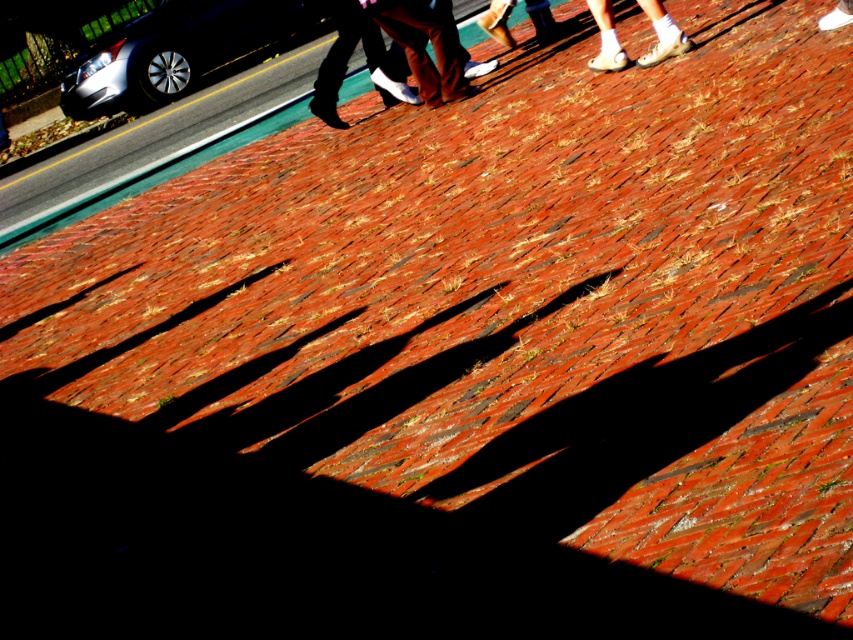
Question: Is brown leather shoes at upper center closer to the viewer compared to matte brown pants at upper center?

Choices:
 (A) yes
 (B) no

Answer: (A)

Question: Does satin silver car at upper left appear on the left side of brown leather shoes at upper center?

Choices:
 (A) yes
 (B) no

Answer: (A)

Question: Which point is closer to the camera taking this photo?

Choices:
 (A) (654, 51)
 (B) (498, 26)
 (C) (270, 28)
 (D) (427, 52)

Answer: (A)

Question: Does brown leather shoes at upper center have a smaller size compared to white socks at upper center?

Choices:
 (A) yes
 (B) no

Answer: (B)

Question: Which of the following is the farthest from the observer?

Choices:
 (A) satin silver car at upper left
 (B) brown leather shoes at upper center

Answer: (A)

Question: Among these objects, which one is nearest to the camera?

Choices:
 (A) satin silver car at upper left
 (B) brown leather shoes at upper center
 (C) white socks at upper center
 (D) matte brown pants at upper center

Answer: (C)